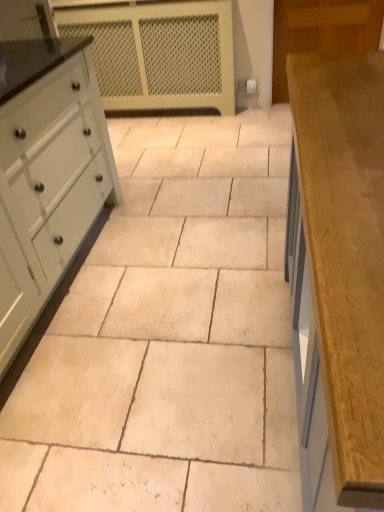
At what (x,y) coordinates should I click in order to perform the action: click on vacant space to the right of white painted wood chest of drawers at left. Please return your answer as a coordinate pair (x, y). This screenshot has width=384, height=512. Looking at the image, I should click on (185, 215).